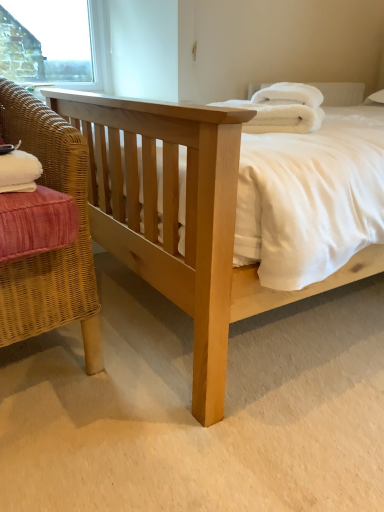
Question: Is the surface of natural wood bed at center in direct contact with white plastic window frame at upper left?

Choices:
 (A) yes
 (B) no

Answer: (B)

Question: Does natural wood bed at center turn towards white plastic window frame at upper left?

Choices:
 (A) no
 (B) yes

Answer: (A)

Question: Does natural wood bed at center have a greater height compared to white plastic window frame at upper left?

Choices:
 (A) yes
 (B) no

Answer: (A)

Question: Does natural wood bed at center have a lesser height compared to white plastic window frame at upper left?

Choices:
 (A) yes
 (B) no

Answer: (B)

Question: Is natural wood bed at center to the right of white plastic window frame at upper left from the viewer's perspective?

Choices:
 (A) no
 (B) yes

Answer: (B)

Question: Relative to woven wicker chair at left, is white fluffy bath towel at upper right in front or behind?

Choices:
 (A) behind
 (B) front

Answer: (A)

Question: From a real-world perspective, relative to woven wicker chair at left, is white fluffy bath towel at upper right vertically above or below?

Choices:
 (A) above
 (B) below

Answer: (A)

Question: Looking at their shapes, would you say white fluffy bath towel at upper right is wider or thinner than woven wicker chair at left?

Choices:
 (A) wide
 (B) thin

Answer: (B)

Question: Considering the positions of point (258, 114) and point (97, 305), is point (258, 114) closer or farther from the camera than point (97, 305)?

Choices:
 (A) farther
 (B) closer

Answer: (A)

Question: Based on their positions, is white plastic window frame at upper left located to the left or right of woven wicker chair at left?

Choices:
 (A) left
 (B) right

Answer: (A)

Question: Looking at the image, does white plastic window frame at upper left seem bigger or smaller compared to woven wicker chair at left?

Choices:
 (A) small
 (B) big

Answer: (A)

Question: Relative to woven wicker chair at left, is white plastic window frame at upper left in front or behind?

Choices:
 (A) behind
 (B) front

Answer: (A)

Question: From a real-world perspective, is white plastic window frame at upper left physically located above or below woven wicker chair at left?

Choices:
 (A) above
 (B) below

Answer: (A)

Question: Considering the positions of point (96, 331) and point (84, 19), is point (96, 331) closer or farther from the camera than point (84, 19)?

Choices:
 (A) closer
 (B) farther

Answer: (A)

Question: Would you say woven wicker chair at left is inside or outside white plastic window frame at upper left?

Choices:
 (A) outside
 (B) inside

Answer: (A)